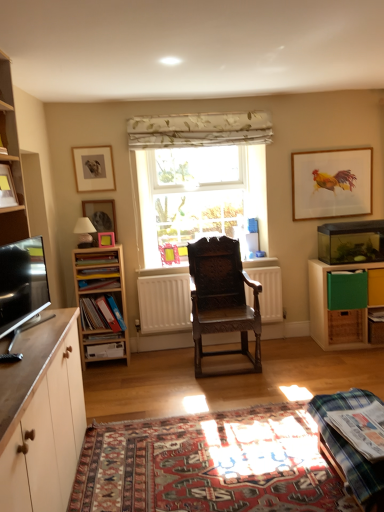
Question: Is green plastic drawer at right, which ranks as the 2th drawer in bottom-to-top order, thinner than plaid fabric table at lower right?

Choices:
 (A) no
 (B) yes

Answer: (B)

Question: Is green plastic drawer at right, which ranks as the 2th drawer in bottom-to-top order, outside plaid fabric table at lower right?

Choices:
 (A) no
 (B) yes

Answer: (B)

Question: Is green plastic drawer at right, acting as the first drawer starting from the top, surrounding plaid fabric table at lower right?

Choices:
 (A) no
 (B) yes

Answer: (A)

Question: Is green plastic drawer at right, acting as the first drawer starting from the top, positioned with its back to plaid fabric table at lower right?

Choices:
 (A) yes
 (B) no

Answer: (B)

Question: From a real-world perspective, is green plastic drawer at right, which ranks as the 2th drawer in bottom-to-top order, under plaid fabric table at lower right?

Choices:
 (A) no
 (B) yes

Answer: (A)

Question: Looking at their shapes, would you say matte black lampshade at upper left is wider or thinner than carpet at center?

Choices:
 (A) thin
 (B) wide

Answer: (A)

Question: Choose the correct answer: Is matte black lampshade at upper left inside carpet at center or outside it?

Choices:
 (A) outside
 (B) inside

Answer: (A)

Question: From the image's perspective, relative to carpet at center, is matte black lampshade at upper left above or below?

Choices:
 (A) above
 (B) below

Answer: (A)

Question: From a real-world perspective, relative to carpet at center, is matte black lampshade at upper left vertically above or below?

Choices:
 (A) below
 (B) above

Answer: (B)

Question: Is plaid fabric table at lower right taller or shorter than pink plastic picture frame at left, positioned as the 2th picture frame in left-to-right order?

Choices:
 (A) tall
 (B) short

Answer: (B)

Question: Relative to pink plastic picture frame at left, positioned as the 2th picture frame in left-to-right order, is plaid fabric table at lower right in front or behind?

Choices:
 (A) front
 (B) behind

Answer: (A)

Question: Do you think plaid fabric table at lower right is within pink plastic picture frame at left, which is the third picture frame from right to left, or outside of it?

Choices:
 (A) outside
 (B) inside

Answer: (A)

Question: Looking at the image, does plaid fabric table at lower right seem bigger or smaller compared to pink plastic picture frame at left, placed as the 3th picture frame when sorted from front to back?

Choices:
 (A) big
 (B) small

Answer: (A)

Question: Does point (69, 326) appear closer or farther from the camera than point (102, 153)?

Choices:
 (A) farther
 (B) closer

Answer: (B)

Question: Considering the relative positions of white matte cabinet at lower left, the 2th cabinetry positioned from the back, and matte wooden picture frame at upper left, marked as the third picture frame in a back-to-front arrangement, in the image provided, is white matte cabinet at lower left, the 2th cabinetry positioned from the back, to the left or to the right of matte wooden picture frame at upper left, marked as the third picture frame in a back-to-front arrangement,?

Choices:
 (A) left
 (B) right

Answer: (B)